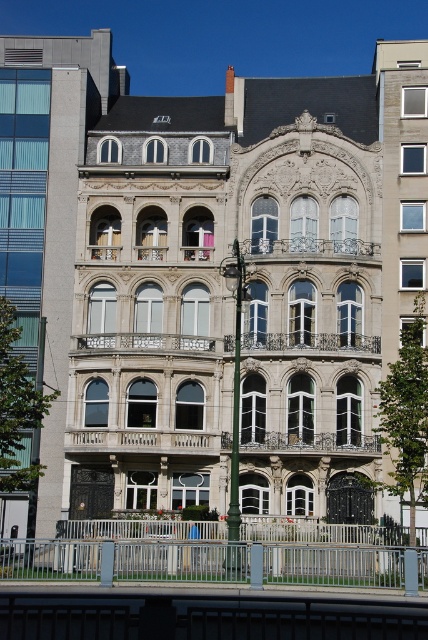
You are a painter who needs to decide which object to paint first. The silver metallic railing at lower center and the green metallic pole at center are both in your view. Based on their widths, which one do you think requires more paint?

The silver metallic railing at lower center might be wider than green metallic pole at center, so it likely requires more paint.

You are standing in front of the grand building and notice the silver metallic railing at lower center and the green metallic pole at center. Which object is located to the left of the other?

The silver metallic railing at lower center is positioned on the left side of green metallic pole at center.

You are standing in front of the grand building and notice a specific point marked at coordinates [341,564]. Based on the building description, can you identify what this point is pointing to?

The point at coordinates [341,564] corresponds to the silver metallic railing at lower center.